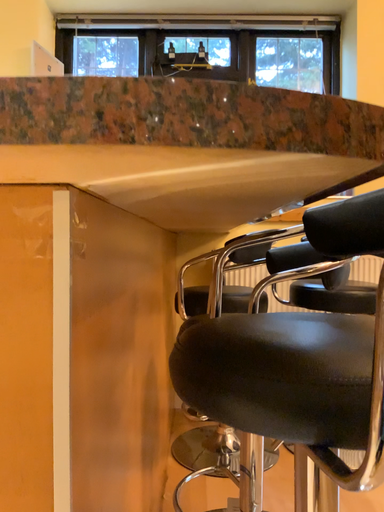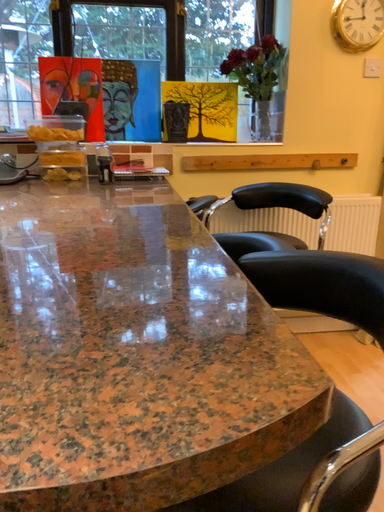
Question: How did the camera likely rotate when shooting the video?

Choices:
 (A) rotated downward
 (B) rotated upward

Answer: (A)